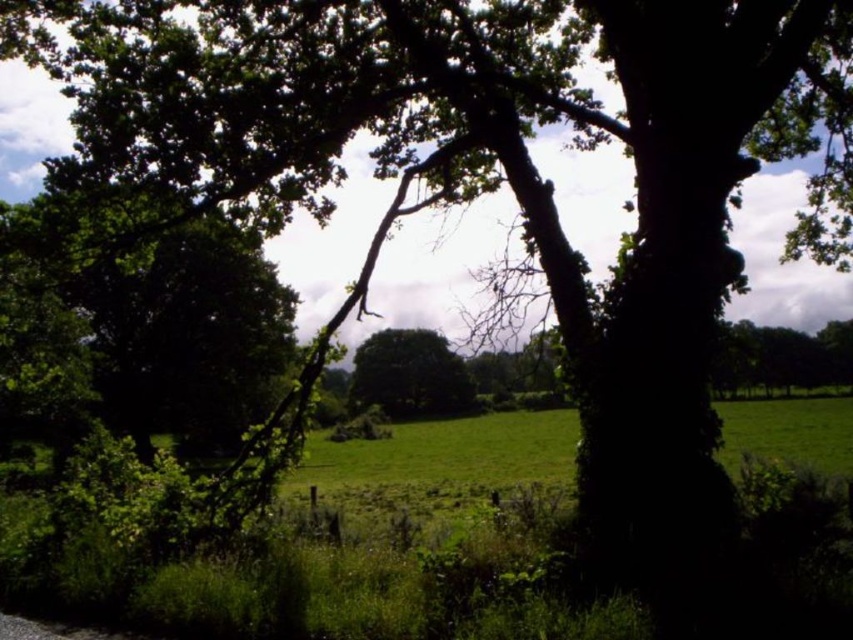
You are a hiker trying to determine which tree to rest under. The green leafy tree at left and the green leafy tree at center are both options. Based on their sizes, which one would provide more shade?

The green leafy tree at left is bigger than the green leafy tree at center, so it would provide more shade.

You are standing at the center of the open grassland and want to walk towards the green leafy tree at left. In which general direction should you head?

The green leafy tree at left is located at point 0.486 on the x and 0.192 on the y coordinate. Since you are at the center, you should head towards the left direction to reach the tree.